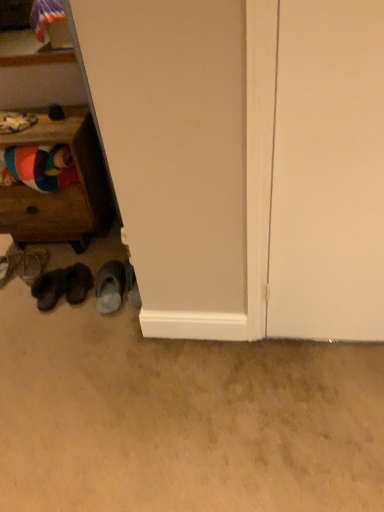
Question: Can you confirm if leather sandal at lower left, which is the fifth footwear from right to left, is wider than multicolored fabric at left?

Choices:
 (A) yes
 (B) no

Answer: (A)

Question: From a real-world perspective, is leather sandal at lower left, which is the fifth footwear from right to left, under multicolored fabric at left?

Choices:
 (A) no
 (B) yes

Answer: (B)

Question: Does leather sandal at lower left, which is the fifth footwear from right to left, lie behind multicolored fabric at left?

Choices:
 (A) yes
 (B) no

Answer: (A)

Question: Is leather sandal at lower left, which is the fifth footwear from right to left, oriented towards multicolored fabric at left?

Choices:
 (A) yes
 (B) no

Answer: (B)

Question: Can you confirm if leather sandal at lower left, the first footwear viewed from the left, is positioned to the right of multicolored fabric at left?

Choices:
 (A) no
 (B) yes

Answer: (A)

Question: From the image's perspective, relative to brown suede shoes at lower left, arranged as the 2th footwear when viewed from the right, is leather sandal at lower left, which is the fifth footwear from right to left, above or below?

Choices:
 (A) above
 (B) below

Answer: (A)

Question: Is leather sandal at lower left, the first footwear viewed from the left, wider or thinner than brown suede shoes at lower left, the fourth footwear positioned from the left?

Choices:
 (A) thin
 (B) wide

Answer: (A)

Question: In the image, is leather sandal at lower left, the first footwear viewed from the left, positioned in front of or behind brown suede shoes at lower left, the fourth footwear positioned from the left?

Choices:
 (A) behind
 (B) front

Answer: (A)

Question: Is point (4, 258) positioned closer to the camera than point (69, 291)?

Choices:
 (A) farther
 (B) closer

Answer: (A)

Question: Considering the positions of leather sandal at lower left, which is counted as the 2th footwear, starting from the left, and wooden drawer at left in the image, is leather sandal at lower left, which is counted as the 2th footwear, starting from the left, taller or shorter than wooden drawer at left?

Choices:
 (A) short
 (B) tall

Answer: (A)

Question: Is leather sandal at lower left, the 4th footwear positioned from the right, situated inside wooden drawer at left or outside?

Choices:
 (A) outside
 (B) inside

Answer: (A)

Question: Is point (44, 264) positioned closer to the camera than point (74, 225)?

Choices:
 (A) farther
 (B) closer

Answer: (A)

Question: Considering the positions of leather sandal at lower left, the 4th footwear positioned from the right, and wooden drawer at left in the image, is leather sandal at lower left, the 4th footwear positioned from the right, wider or thinner than wooden drawer at left?

Choices:
 (A) thin
 (B) wide

Answer: (A)

Question: Would you say gray fuzzy slippers at lower left, the 1th footwear when ordered from right to left, is to the left or to the right of leather sandal at lower left, the first footwear viewed from the left, in the picture?

Choices:
 (A) left
 (B) right

Answer: (B)

Question: In terms of height, does gray fuzzy slippers at lower left, the 5th footwear when ordered from left to right, look taller or shorter compared to leather sandal at lower left, which is the fifth footwear from right to left?

Choices:
 (A) short
 (B) tall

Answer: (B)